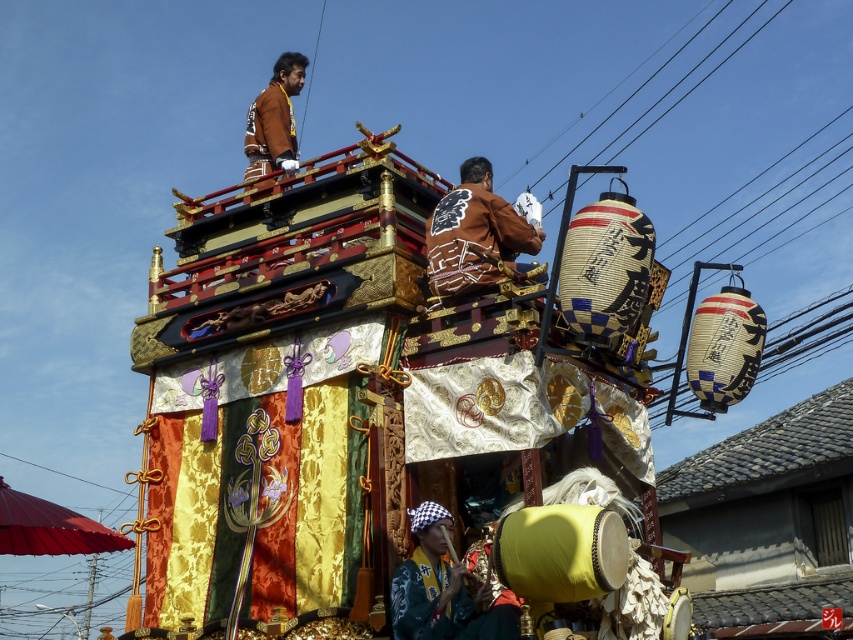
You are a photographer at the festival and want to capture a photo of the brown leather jacket at upper center and the silk fabric headscarf at lower center. Which object should you focus on first if you want to include both in the frame without moving the camera?

The silk fabric headscarf at lower center is positioned on the right side of the brown leather jacket at upper center, so you should focus on the brown leather jacket at upper center first to ensure both are in the frame.

You are a photographer capturing the festival scene. You notice the brown leather jacket at upper center and the black wire at upper center. Which object is positioned to the right side of the other?

The brown leather jacket at upper center is to the left of the black wire at upper center, so the black wire at upper center is positioned to the right side of the brown leather jacket at upper center.

You are a photographer taking a picture of the silk fabric headscarf at lower center. The camera you are using has a 10cm wide aperture. Where should you position the aperture to capture the headscarf in the center of the photo?

The silk fabric headscarf at lower center is located at point (442, 589). To center it in the photo, position the aperture so its center aligns with these coordinates, ensuring the headscarf is framed precisely in the middle.